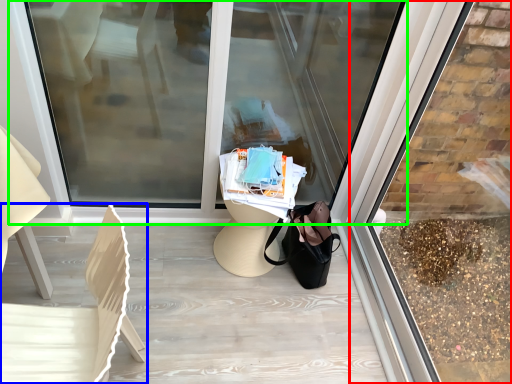
Question: Considering the real-world distances, which object is farthest from shop window (highlighted by a red box)? chair (highlighted by a blue box) or shop window (highlighted by a green box)?

Choices:
 (A) chair
 (B) shop window

Answer: (A)